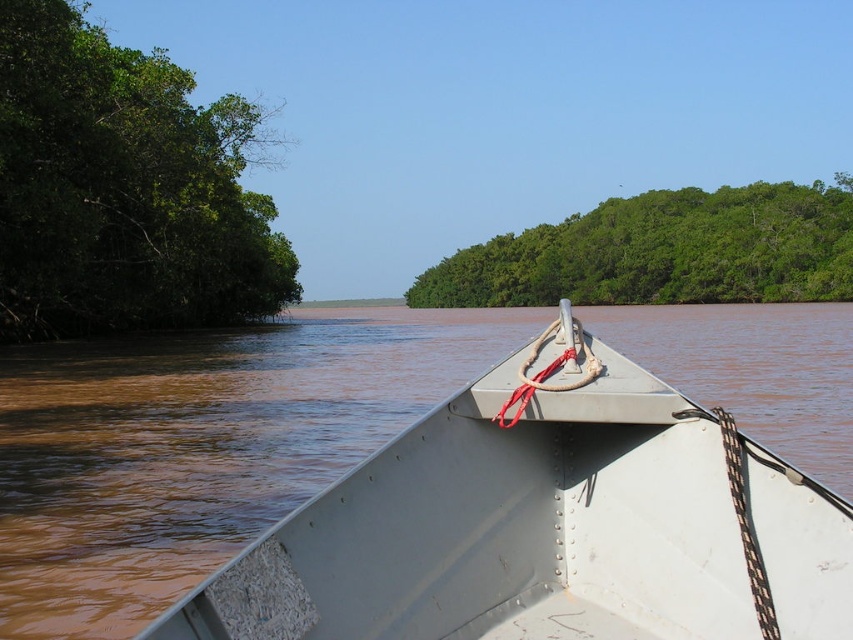
Is point (828, 598) positioned behind point (802, 184)?

No, it is not.

In the scene shown: Is metallic gray boat at center above green leafy trees at upper center?

Incorrect, metallic gray boat at center is not positioned above green leafy trees at upper center.

Between point (422, 456) and point (764, 252), which one is positioned behind?

Point (764, 252)

At what (x,y) coordinates should I click in order to perform the action: click on metallic gray boat at center. Please return your answer as a coordinate pair (x, y). Looking at the image, I should click on (547, 524).

Which is in front, point (502, 636) or point (239, 189)?

Positioned in front is point (502, 636).

Does metallic gray boat at center have a lesser height compared to green leafy trees at left?

Indeed, metallic gray boat at center has a lesser height compared to green leafy trees at left.

The image size is (853, 640). Describe the element at coordinates (547, 524) in the screenshot. I see `metallic gray boat at center` at that location.

Find the location of a particular element. Image resolution: width=853 pixels, height=640 pixels. metallic gray boat at center is located at coordinates (547, 524).

Is green leafy trees at left taller than green leafy trees at upper center?

In fact, green leafy trees at left may be shorter than green leafy trees at upper center.

The image size is (853, 640). What do you see at coordinates (123, 189) in the screenshot?
I see `green leafy trees at left` at bounding box center [123, 189].

Find the location of a particular element. This screenshot has width=853, height=640. green leafy trees at left is located at coordinates (123, 189).

This screenshot has width=853, height=640. What are the coordinates of `green leafy trees at left` in the screenshot? It's located at (123, 189).